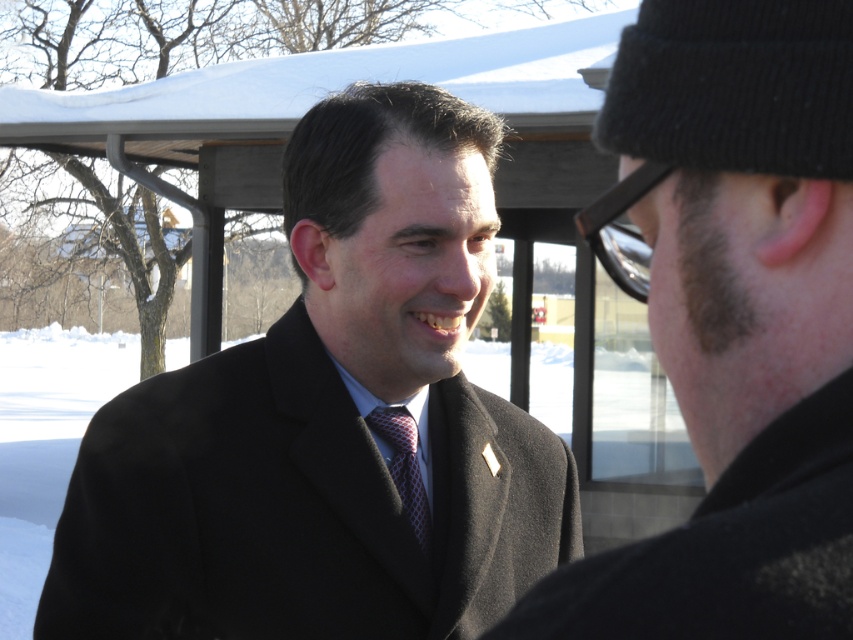
You are a fashion designer observing the scene. You need to determine which item is narrower between the black wool coat at center and the metallic reflective goggles at right. Which one is it?

The black wool coat at center has a lesser width compared to metallic reflective goggles at right, so the black wool coat at center is narrower.

You are standing in front of the snowy scene and want to place a small decoration. You have two points marked in the image, point (498, 595) and point (410, 429). Which point is closer to you?

Point (498, 595) is closer to the viewer than point (410, 429).

You are a fashion designer observing two people in winter attire. You notice the black wool coat at center and the red checkered tie at center. Which clothing item is positioned higher on their respective wearers?

The black wool coat at center is positioned higher than the red checkered tie at center because it is much taller as the tie.